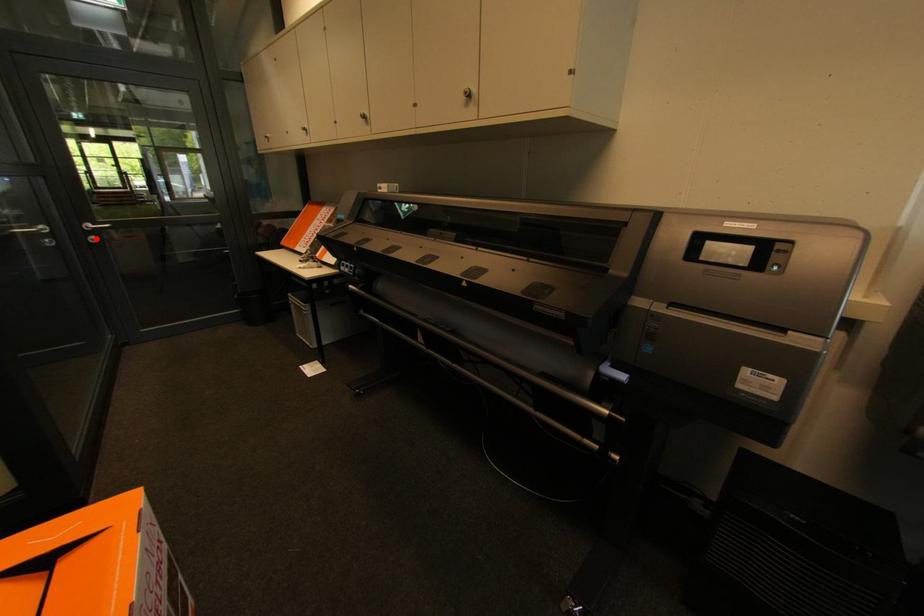
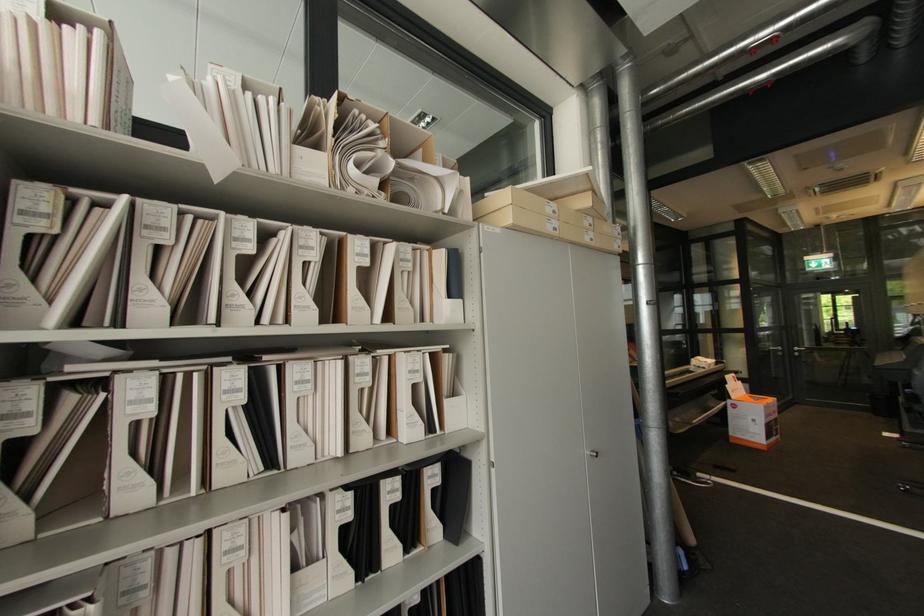
Question: I am providing you with two images of the same scene from different viewpoints. A red point is shown in image1. For the corresponding object point in image2, is it positioned nearer or farther from the camera?

Choices:
 (A) Nearer
 (B) Farther

Answer: (A)